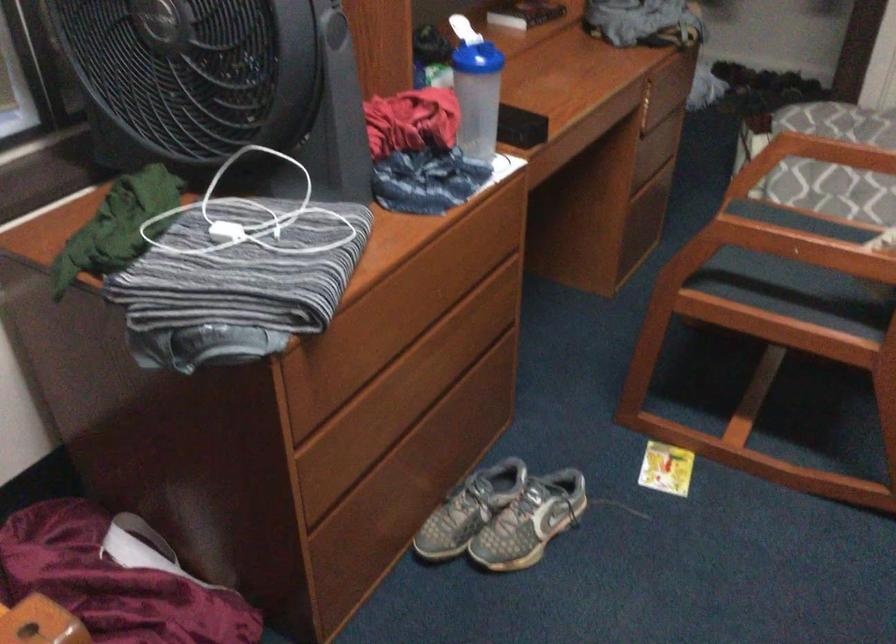
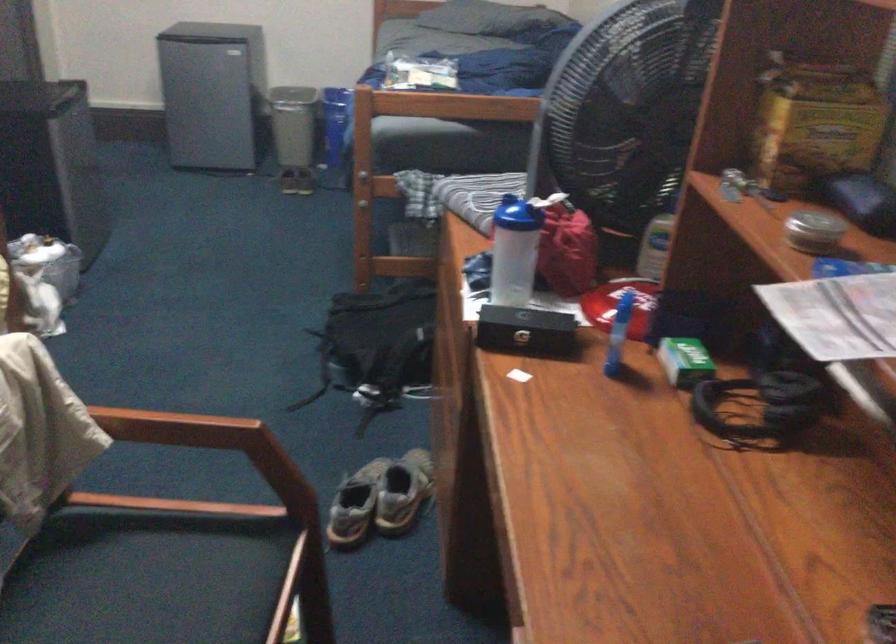
Where in the second image is the point corresponding to point 800,260 from the first image?

(162, 579)